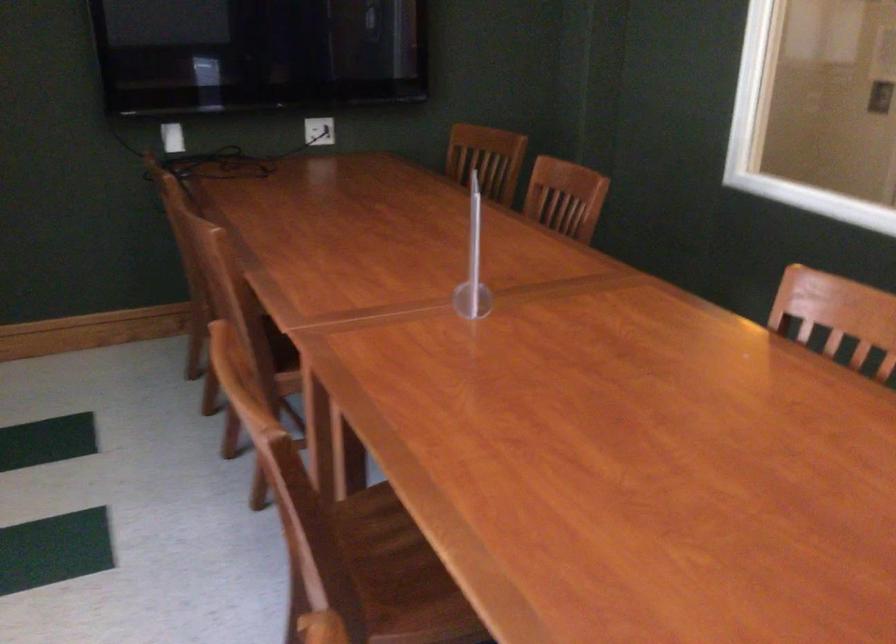
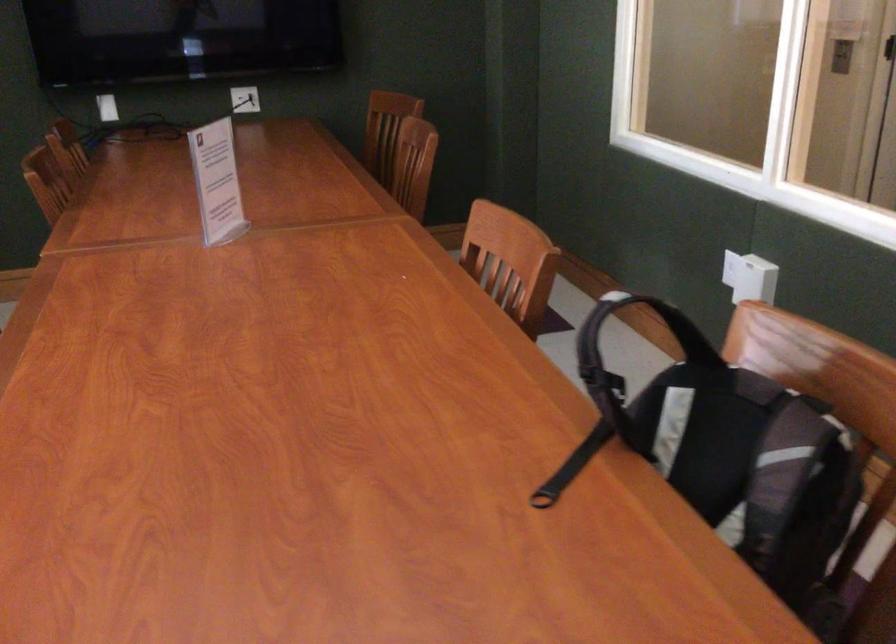
Question: I am providing you with two images of the same scene from different viewpoints. After the viewpoint changes to image2, which objects are now occluded?

Choices:
 (A) white power outlet
 (B) backpack handle
 (C) wooden chair seat
 (D) gold zipper pull

Answer: (C)